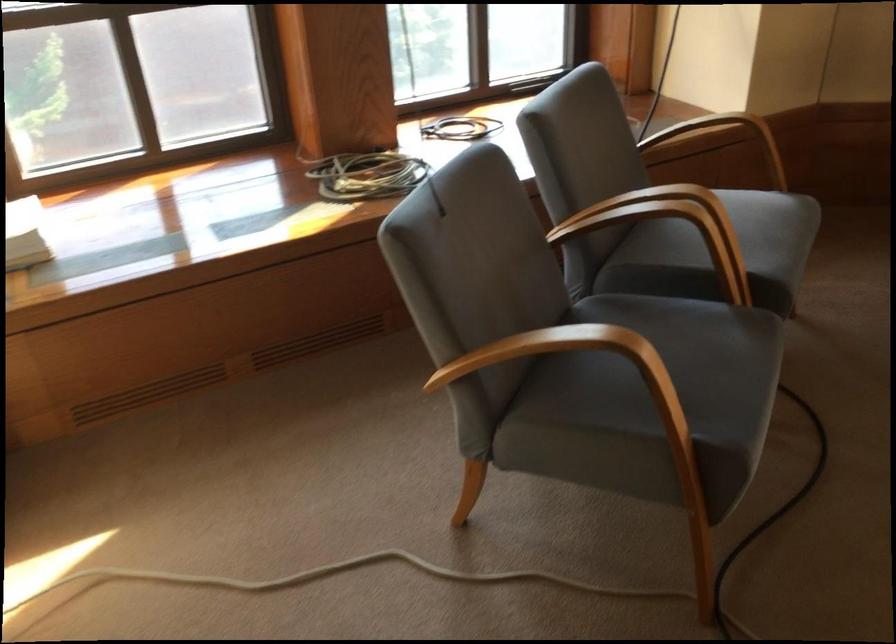
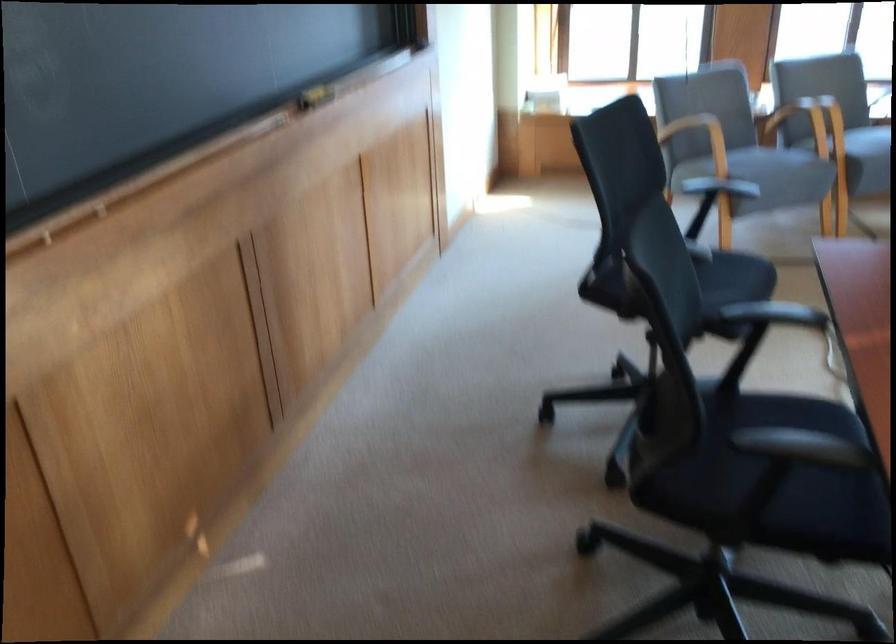
Find the pixel in the second image that matches (x=539, y=383) in the first image.

(700, 138)